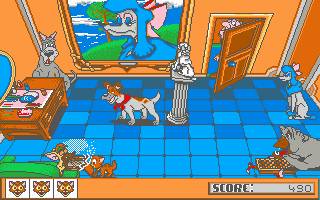
At what (x,y) coordinates should I click in order to perform the action: click on drawer. Please return your answer as a coordinate pair (x, y). The image size is (320, 200). Looking at the image, I should click on (48, 115), (47, 120), (60, 99), (56, 94).